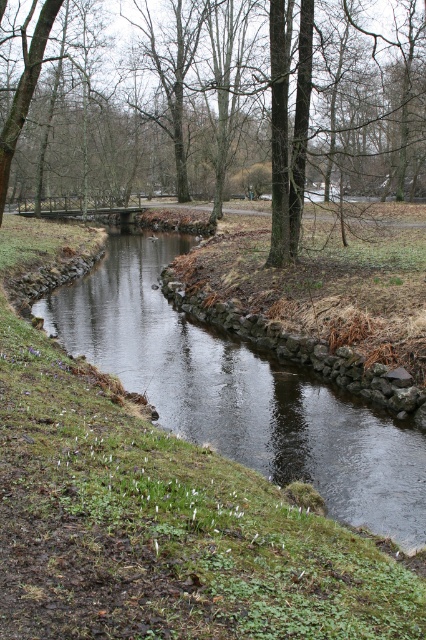
Question: Which of the following is the farthest from the observer?

Choices:
 (A) (54, 177)
 (B) (339, 429)

Answer: (A)

Question: Considering the relative positions of brown bark tree at center and dark gray stone stream at center in the image provided, where is brown bark tree at center located with respect to dark gray stone stream at center?

Choices:
 (A) right
 (B) left

Answer: (B)

Question: Is the position of brown bark tree at center less distant than that of dark gray stone stream at center?

Choices:
 (A) yes
 (B) no

Answer: (B)

Question: Which object is closer to the camera taking this photo?

Choices:
 (A) brown bark tree at center
 (B) dark gray stone stream at center

Answer: (B)

Question: Can you confirm if brown bark tree at center is positioned to the left of dark gray stone stream at center?

Choices:
 (A) no
 (B) yes

Answer: (B)